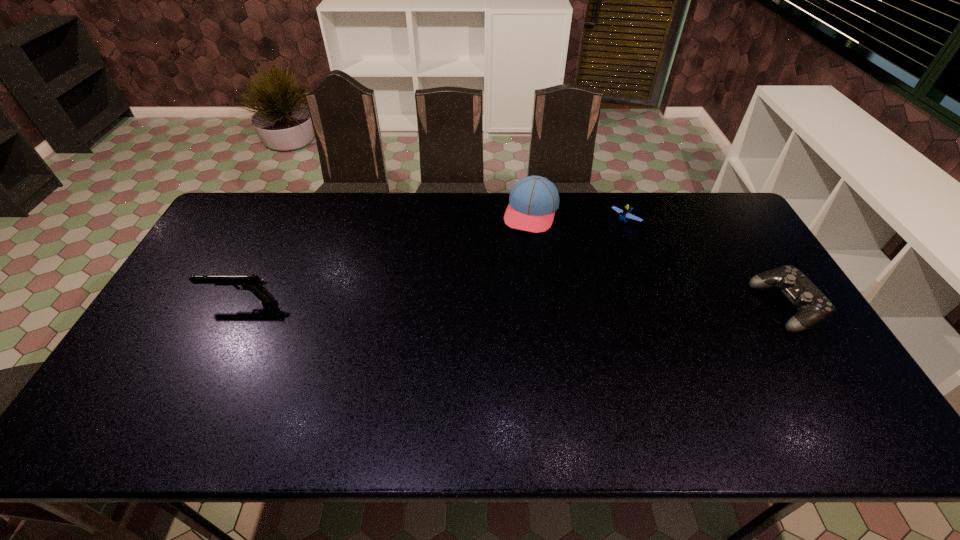
At what (x,y) coordinates should I click in order to perform the action: click on free space on the desktop that is between the leftmost object and the control and is positioned on the front-facing side of the third object from right to left. Please return your answer as a coordinate pair (x, y). The image size is (960, 540). Looking at the image, I should click on (495, 304).

Identify the location of free space on the desktop that is between the leftmost object and the rightmost object and is positioned on the front-facing side of the shortest object. (534, 305).